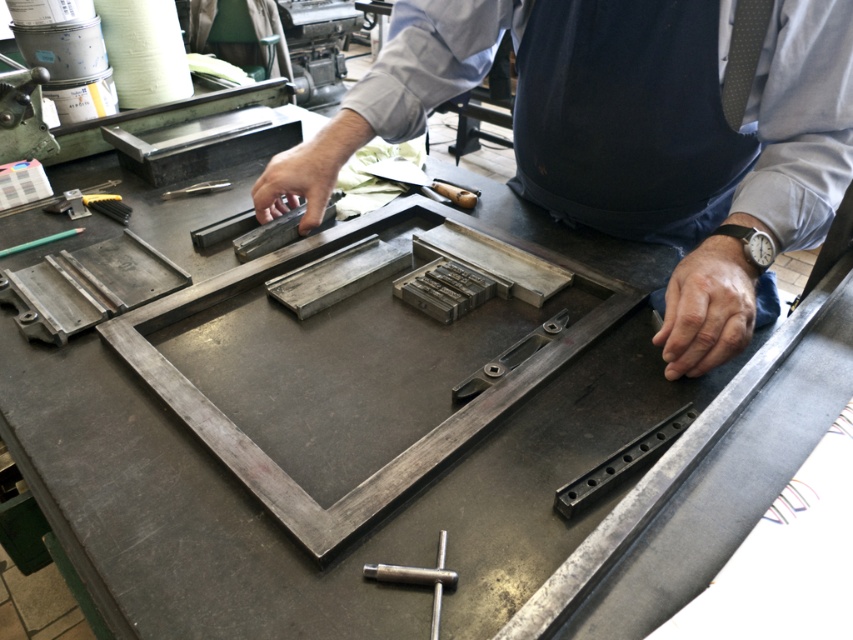
Looking at this image, can you confirm if metallic gray handle at center is bigger than metallic wood-handled tool at center?

Actually, metallic gray handle at center might be smaller than metallic wood-handled tool at center.

Is metallic gray handle at center shorter than metallic wood-handled tool at center?

Correct, metallic gray handle at center is not as tall as metallic wood-handled tool at center.

Locate an element on the screen. This screenshot has height=640, width=853. metallic gray handle at center is located at coordinates (509, 356).

Between metallic gray frame at center and metallic wood-handled tool at center, which one is positioned higher?

metallic wood-handled tool at center is higher up.

Is point (695, 340) positioned behind point (395, 157)?

No, it is not.

At what (x,y) coordinates should I click in order to perform the action: click on metallic gray frame at center. Please return your answer as a coordinate pair (x, y). This screenshot has width=853, height=640. Looking at the image, I should click on (630, 132).

Locate an element on the screen. metallic gray frame at center is located at coordinates (630, 132).

Does point (637, 148) come in front of point (403, 173)?

That is True.

Does dark blue fabric apron at center appear on the left side of metallic wood-handled tool at center?

In fact, dark blue fabric apron at center is to the right of metallic wood-handled tool at center.

Which is in front, point (711, 120) or point (405, 166)?

Point (711, 120)

This screenshot has width=853, height=640. In order to click on dark blue fabric apron at center in this screenshot , I will do `click(625, 118)`.